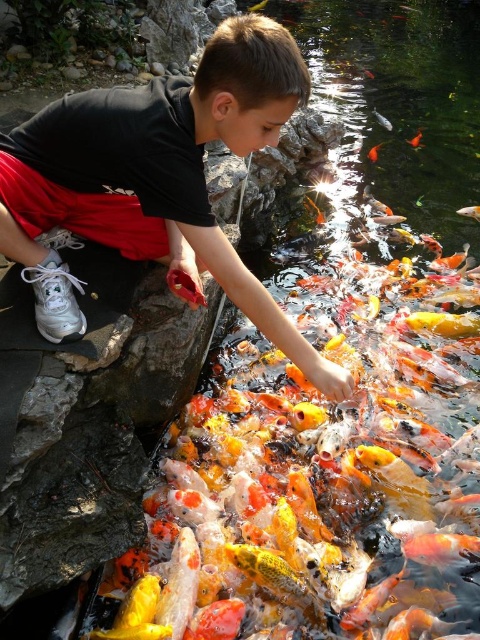
Measure the distance between orange and white textured fish at center and camera.

They are 3.80 meters apart.

Who is taller, orange and white textured fish at center or orange and white scales at upper right?

Standing taller between the two is orange and white scales at upper right.

Image resolution: width=480 pixels, height=640 pixels. Describe the element at coordinates (469, 211) in the screenshot. I see `orange and white textured fish at center` at that location.

I want to click on orange and white textured fish at center, so click(469, 211).

Is black matte shirt at upper left wider than orange and white scales at upper right?

Yes.

Measure the distance between black matte shirt at upper left and camera.

1.33 meters

Identify the location of black matte shirt at upper left. (158, 179).

Can you confirm if orange and white scales at upper right is taller than shiny orange fish at center?

In fact, orange and white scales at upper right may be shorter than shiny orange fish at center.

Who is positioned more to the left, orange and white scales at upper right or shiny orange fish at center?

Positioned to the left is shiny orange fish at center.

Which is in front, point (375, 116) or point (260, 4)?

Point (375, 116) is in front.

Identify the location of orange and white scales at upper right. (383, 120).